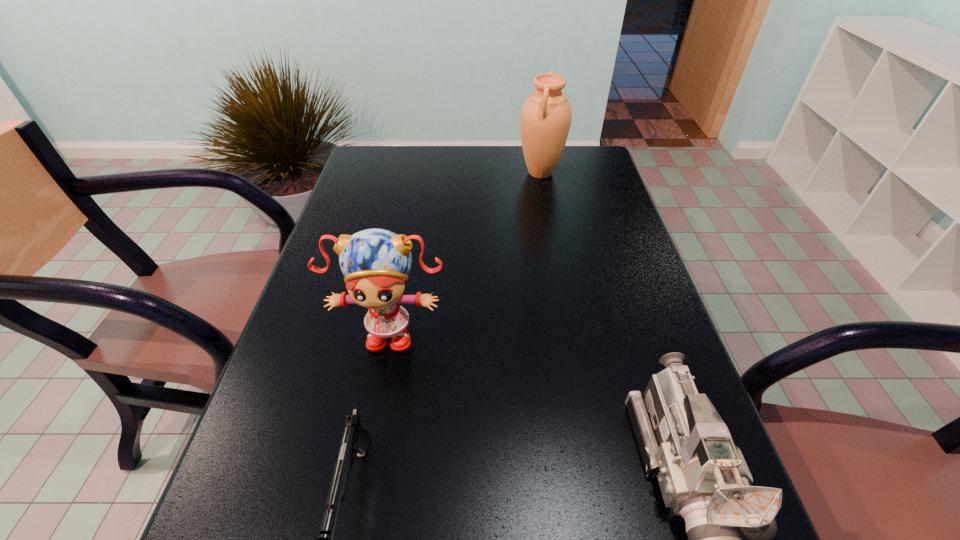
Find the location of `free space at the far edge`. free space at the far edge is located at coordinates (429, 164).

The width and height of the screenshot is (960, 540). I want to click on blank area at the left edge, so click(305, 285).

Image resolution: width=960 pixels, height=540 pixels. In the image, there is a desktop. Find the location of `free space at the right edge`. free space at the right edge is located at coordinates (568, 192).

The width and height of the screenshot is (960, 540). I want to click on free space at the far left corner, so click(x=380, y=166).

Locate which object is the third closest to the second object from right to left. Please provide its 2D coordinates. Your answer should be formatted as a tuple, i.e. [(x, y)], where the tuple contains the x and y coordinates of a point satisfying the conditions above.

[(355, 439)]

Identify the location of object that is the closest to the third shortest object. (355, 439).